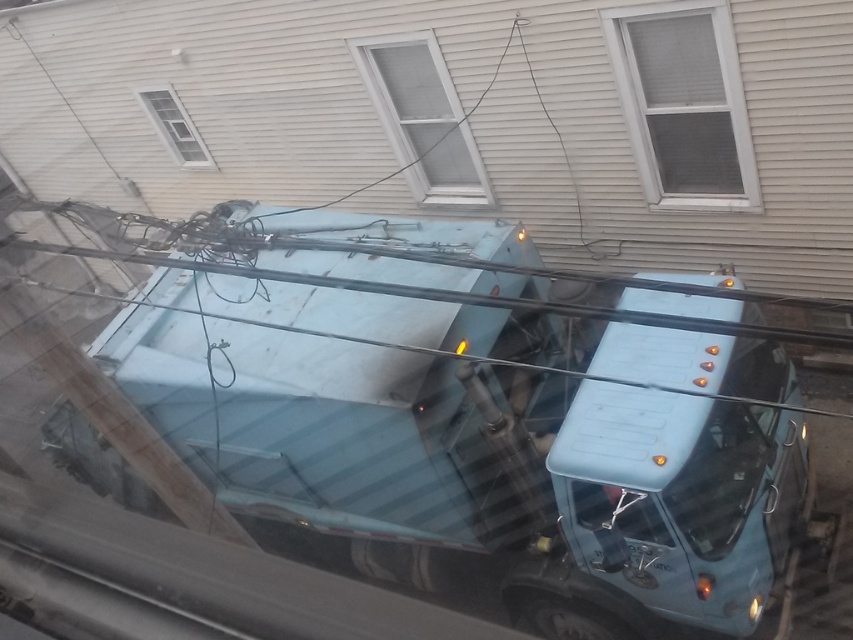
You are a delivery person trying to park your car in the driveway behind the light blue metallic garbage truck at center and the white textured window at upper left. Can you estimate whether the garbage truck is larger than the window?

The light blue metallic garbage truck at center is bigger than the white textured window at upper left, so yes, the garbage truck is larger than the window.

You are standing at the camera position and want to load a 3.5 meter long pipe into the light blue metallic garbage truck at center. Can you reach the truck with the pipe without moving the pipe or the truck?

The distance between you and the light blue metallic garbage truck at center is 3.70 meters, which is slightly longer than the pipe. Since the pipe is 3.5 meters long, you can just barely reach the truck with the pipe without moving either.

You are standing at the camera position and want to load a 3.5 meter long pipe into the light blue metallic garbage truck at center. Can you reach the truck with the pipe without moving the pipe or the truck?

The distance between you and the light blue metallic garbage truck at center is 3.70 meters, which is slightly longer than the pipe. Therefore, you can reach the truck with the 3.5 meter pipe without moving either.